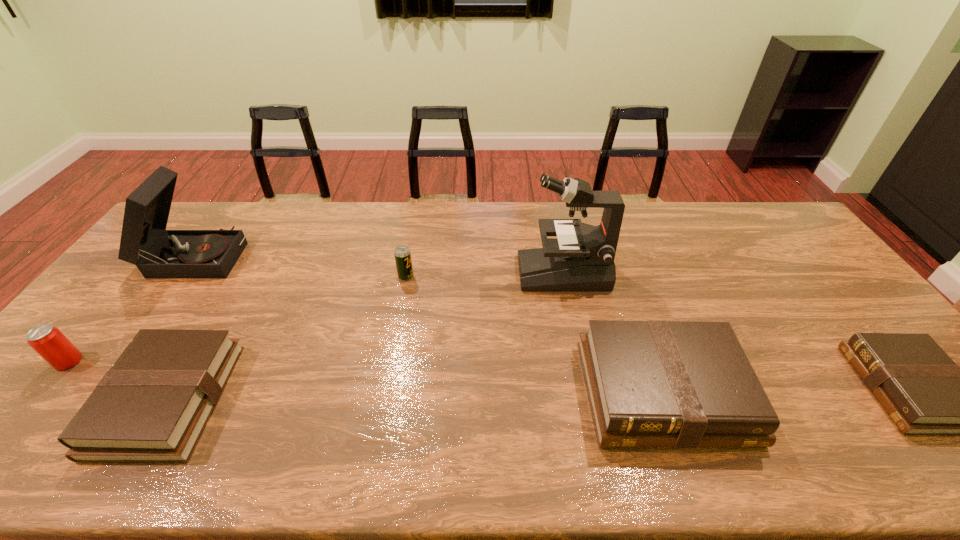
To make them evenly spaced by inserting another Bible among them, please locate a free space for this new Bible. Please provide its 2D coordinates. Your answer should be formatted as a tuple, i.e. [(x, y)], where the tuple contains the x and y coordinates of a point satisfying the conditions above.

[(418, 395)]